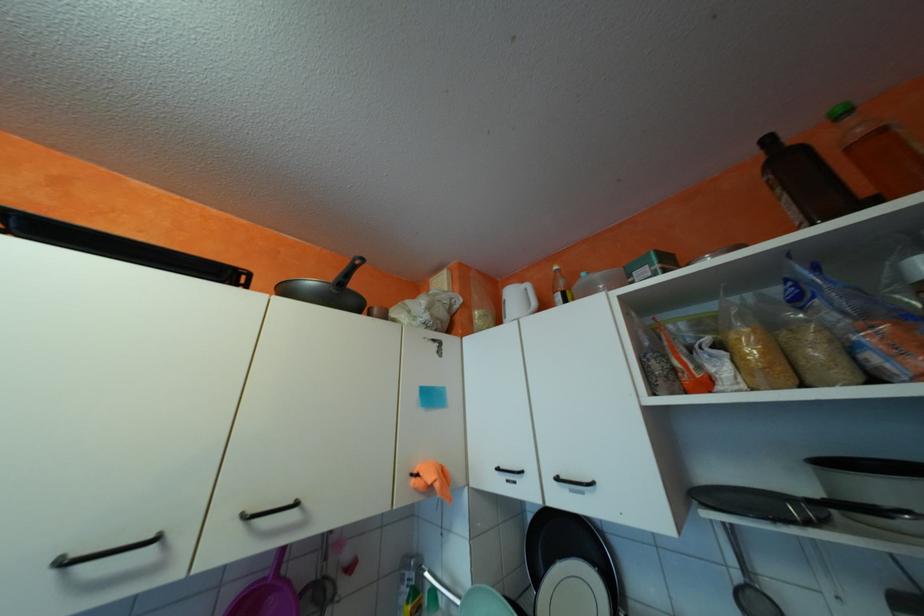
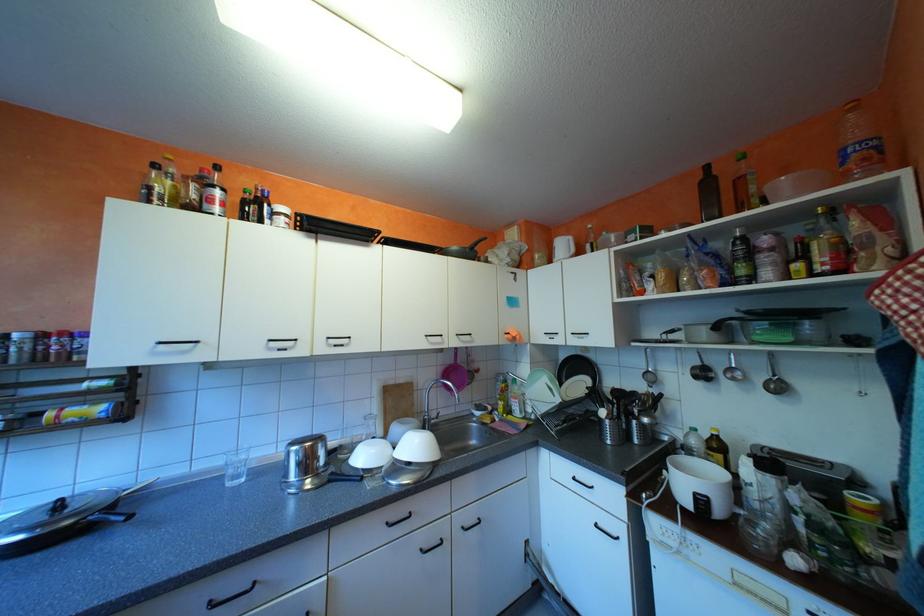
Question: Which direction would the cameraman need to move to produce the second image? Reply with the corresponding letter.

Choices:
 (A) Left
 (B) Right
 (C) Forward
 (D) Backward

Answer: (D)